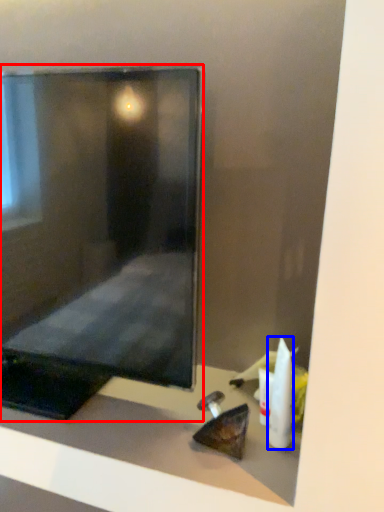
Question: Which object is closer to the camera taking this photo, computer monitor (highlighted by a red box) or toiletry (highlighted by a blue box)?

Choices:
 (A) computer monitor
 (B) toiletry

Answer: (A)